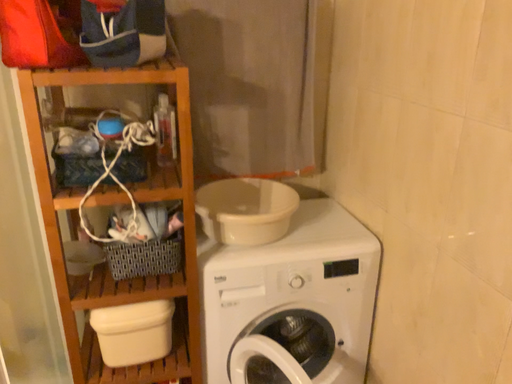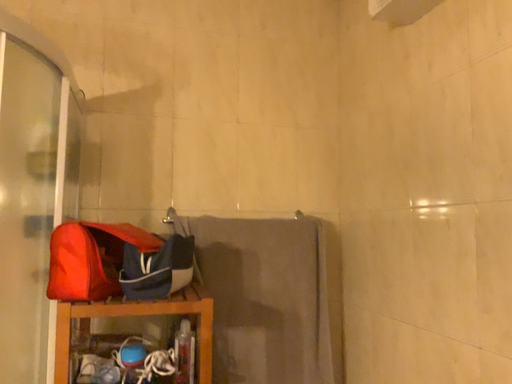
Question: Which way did the camera rotate in the video?

Choices:
 (A) rotated downward
 (B) rotated upward

Answer: (B)